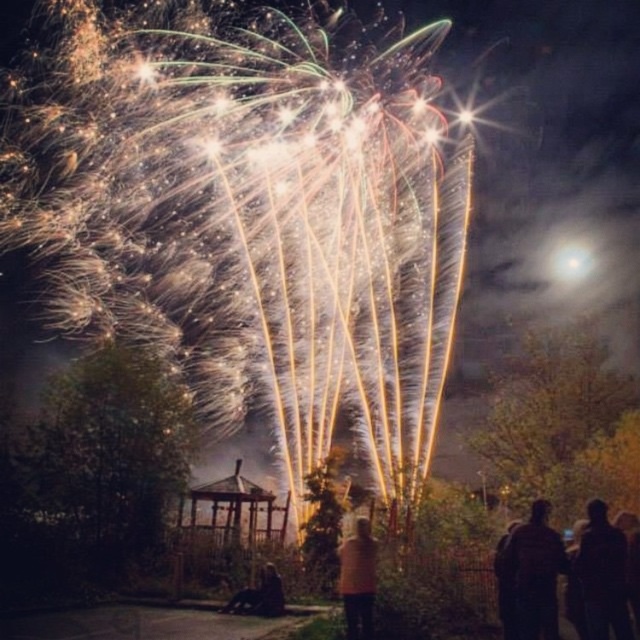
Question: Where is dark fabric silhouette at lower right located in relation to dark hair at lower center in the image?

Choices:
 (A) right
 (B) left

Answer: (A)

Question: Estimate the real-world distances between objects in this image. Which object is farther from the dark fabric silhouette at lower right?

Choices:
 (A) wooden gazebo at center
 (B) brown wool sweater at center
 (C) dark hair at lower center

Answer: (A)

Question: Which point is closer to the camera?

Choices:
 (A) (612, 557)
 (B) (346, 604)
 (C) (276, 538)
 (D) (515, 592)

Answer: (A)

Question: Which object is closer to the camera taking this photo?

Choices:
 (A) dark hair at lower center
 (B) brown wool sweater at center
 (C) dark fabric silhouette at lower right

Answer: (C)

Question: Does brown wool sweater at center have a smaller size compared to dark hair at lower center?

Choices:
 (A) no
 (B) yes

Answer: (A)

Question: Considering the relative positions of dark fabric coat at lower right and dark hair at lower center in the image provided, where is dark fabric coat at lower right located with respect to dark hair at lower center?

Choices:
 (A) above
 (B) below

Answer: (A)